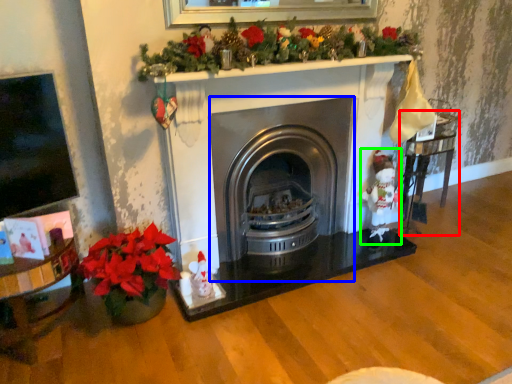
Question: Which object is the closest to the table (highlighted by a red box)? Choose among these: wood burning stove (highlighted by a blue box) or santa claus (highlighted by a green box).

Choices:
 (A) wood burning stove
 (B) santa claus

Answer: (B)